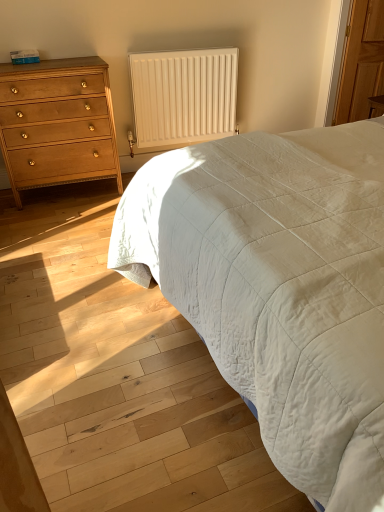
Question: Is matte wood chest of drawers at left at the back of white quilted fabric at center?

Choices:
 (A) no
 (B) yes

Answer: (A)

Question: Does white quilted fabric at center have a lesser height compared to matte wood chest of drawers at left?

Choices:
 (A) no
 (B) yes

Answer: (B)

Question: Is white quilted fabric at center not inside matte wood chest of drawers at left?

Choices:
 (A) no
 (B) yes

Answer: (B)

Question: Is white quilted fabric at center at the right side of matte wood chest of drawers at left?

Choices:
 (A) no
 (B) yes

Answer: (B)

Question: Is the position of white quilted fabric at center less distant than that of matte wood chest of drawers at left?

Choices:
 (A) no
 (B) yes

Answer: (B)

Question: From a real-world perspective, is white quilted fabric at center physically below matte wood chest of drawers at left?

Choices:
 (A) no
 (B) yes

Answer: (B)

Question: Can you confirm if white matte radiator at upper center is smaller than white quilted fabric at center?

Choices:
 (A) no
 (B) yes

Answer: (B)

Question: Is white quilted fabric at center surrounded by white matte radiator at upper center?

Choices:
 (A) no
 (B) yes

Answer: (A)

Question: Are white matte radiator at upper center and white quilted fabric at center located far from each other?

Choices:
 (A) yes
 (B) no

Answer: (A)

Question: Can you see white matte radiator at upper center touching white quilted fabric at center?

Choices:
 (A) yes
 (B) no

Answer: (B)

Question: From the image's perspective, would you say white matte radiator at upper center is positioned over white quilted fabric at center?

Choices:
 (A) no
 (B) yes

Answer: (B)

Question: From a real-world perspective, is white matte radiator at upper center under white quilted fabric at center?

Choices:
 (A) no
 (B) yes

Answer: (A)

Question: From the image's perspective, would you say matte wood chest of drawers at left is shown under white quilted fabric at center?

Choices:
 (A) yes
 (B) no

Answer: (B)